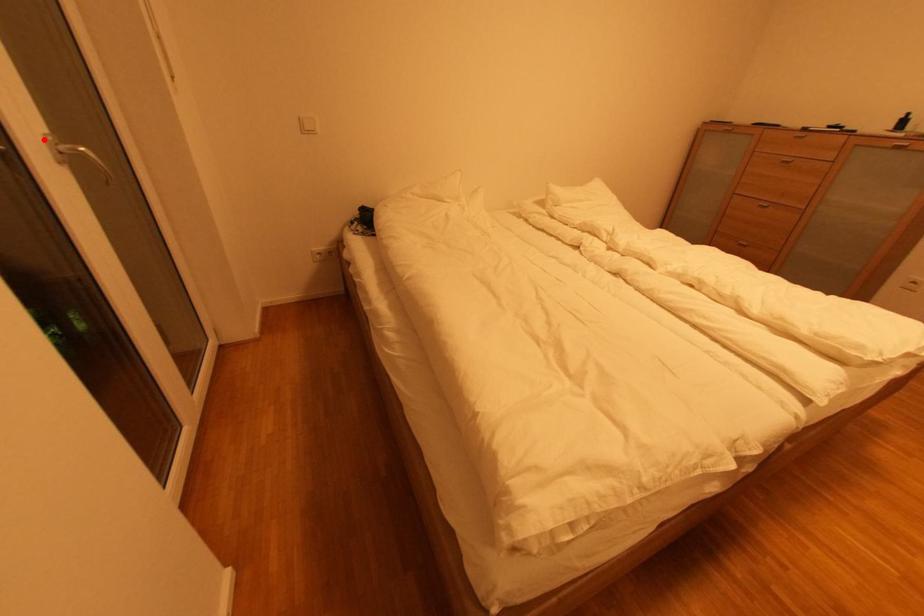
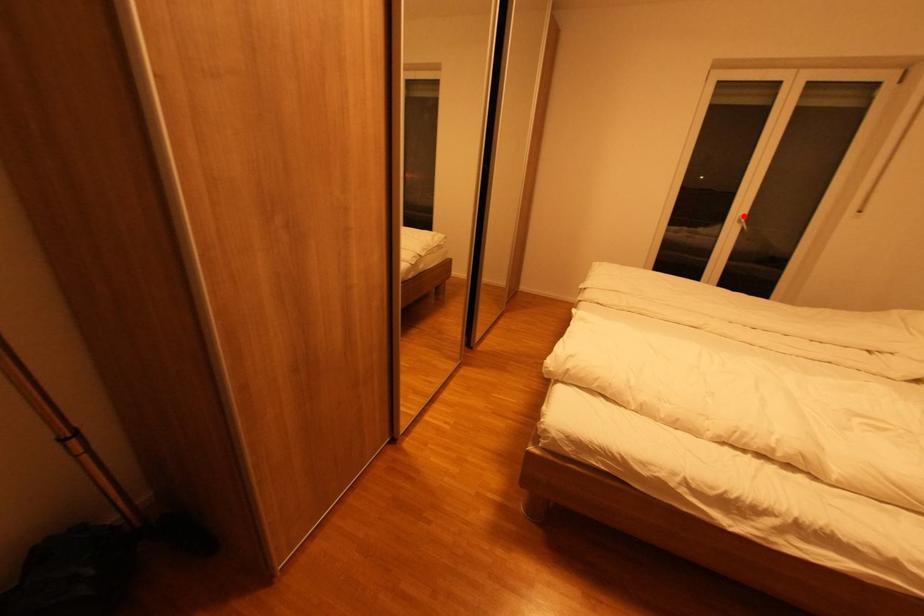
I am providing you with two images of the same scene from different viewpoints. A red point is marked on the first image and another point is marked on the second image. Is the red point in image1 aligned with the point shown in image2?

Yes